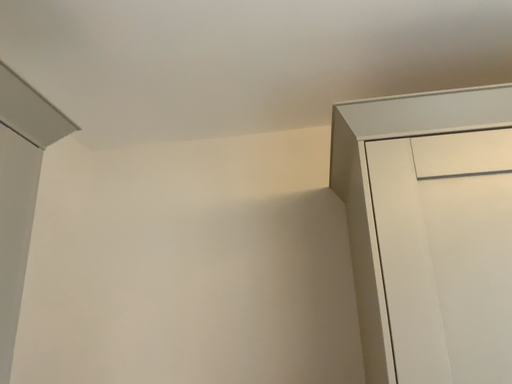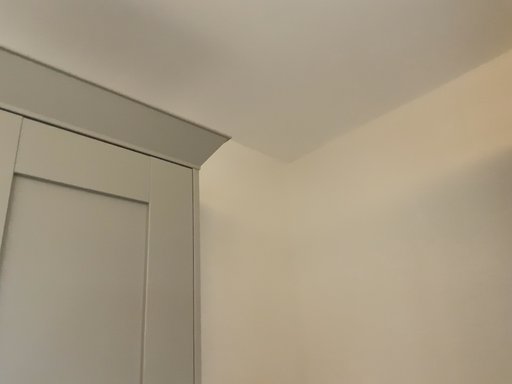
Question: Which way did the camera rotate in the video?

Choices:
 (A) rotated right
 (B) rotated left

Answer: (B)